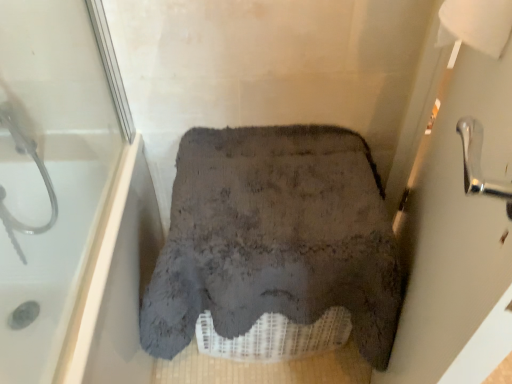
Locate an element on the screen. This screenshot has width=512, height=384. dark gray plush bath towel at center is located at coordinates (274, 237).

Describe the element at coordinates (274, 237) in the screenshot. I see `dark gray plush bath towel at center` at that location.

In order to face dark gray plush bath towel at center, should I rotate leftwards or rightwards?

Turn right by 1.925 degrees to look at dark gray plush bath towel at center.

What is the approximate width of dark gray plush bath towel at center?

51.54 centimeters.

Where is `dark gray plush bath towel at center`? This screenshot has height=384, width=512. dark gray plush bath towel at center is located at coordinates (274, 237).